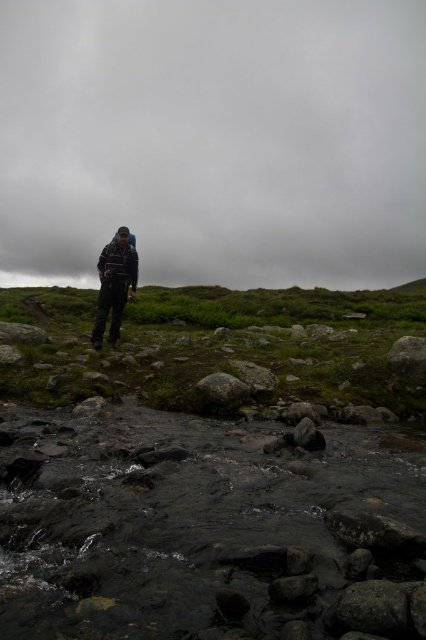
Question: Can you confirm if dark gray rocky stream at center is positioned above green mossy rock at center?

Choices:
 (A) yes
 (B) no

Answer: (B)

Question: Which object is farther from the camera taking this photo?

Choices:
 (A) dark green grass at left
 (B) green mossy rock at center
 (C) dark blue fabric backpack at center

Answer: (C)

Question: Does dark blue fabric backpack at center come in front of green mossy rock at center?

Choices:
 (A) no
 (B) yes

Answer: (A)

Question: Which is nearer to the dark blue fabric backpack at center?

Choices:
 (A) green mossy rock at center
 (B) dark green grass at left
 (C) dark gray textured jacket at center

Answer: (C)

Question: Which is nearer to the green mossy rock at center?

Choices:
 (A) dark blue fabric backpack at center
 (B) dark gray rocky stream at center
 (C) dark gray textured jacket at center

Answer: (B)

Question: Can you confirm if dark gray rocky stream at center is positioned below dark green grass at left?

Choices:
 (A) yes
 (B) no

Answer: (A)